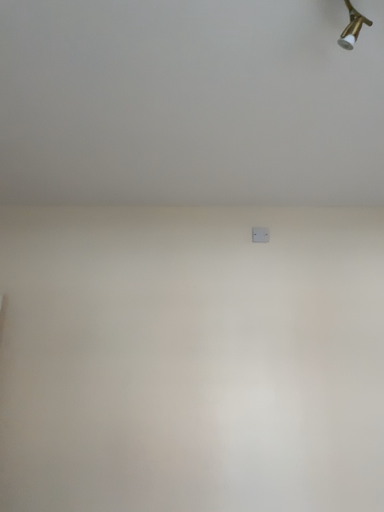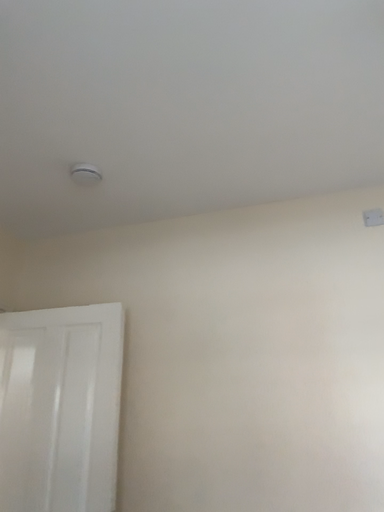
Question: Which way did the camera rotate in the video?

Choices:
 (A) rotated left
 (B) rotated right

Answer: (A)